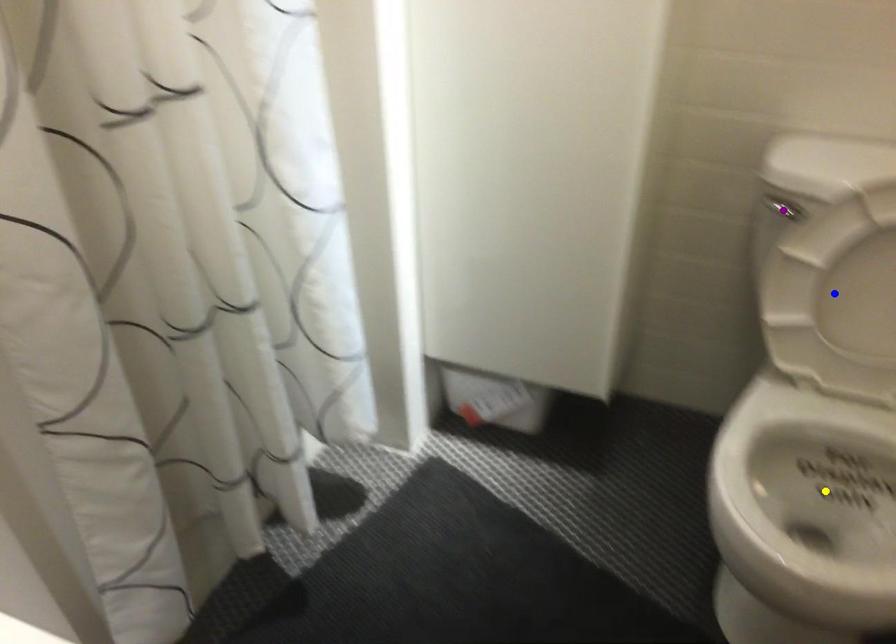
Order these from nearest to farthest:
purple point | blue point | yellow point

1. blue point
2. purple point
3. yellow point